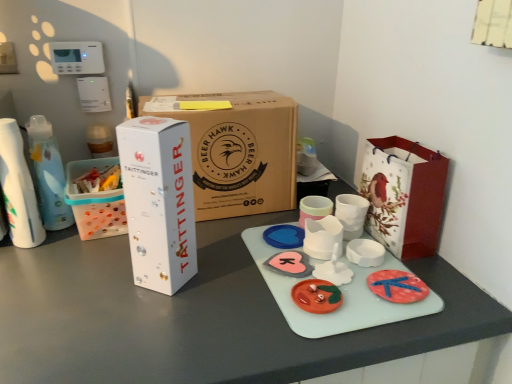
Question: From a real-world perspective, relative to brown cardboard box at center, the second box in the front-to-back sequence, is matte plastic toy at center, acting as the 1th toy starting from the front, vertically above or below?

Choices:
 (A) below
 (B) above

Answer: (A)

Question: Is matte plastic toy at center, the 4th toy from the back, bigger or smaller than brown cardboard box at center, the second box in the front-to-back sequence?

Choices:
 (A) big
 (B) small

Answer: (B)

Question: Which of these objects is positioned farthest from the white paper bag with red bird design at right?

Choices:
 (A) pink matte heart at center, the 3th toy in the front-to-back sequence
 (B) white cardboard box at left
 (C) blue rubber heart at center, which appears as the fourth toy when viewed from the front
 (D) matte plastic toy at center, acting as the 1th toy starting from the front
 (E) white glossy table at center

Answer: (B)

Question: Based on their relative distances, which object is farther from the white glossy box at left, marked as the 1th box in a front-to-back arrangement?

Choices:
 (A) matte plastic toy at center, acting as the 1th toy starting from the front
 (B) blue rubber heart at center, which appears as the fourth toy when viewed from the front
 (C) pink matte heart at center, the 3th toy in the front-to-back sequence
 (D) brown cardboard box at center, the 1th box viewed from the back
 (E) white glossy table at center

Answer: (B)